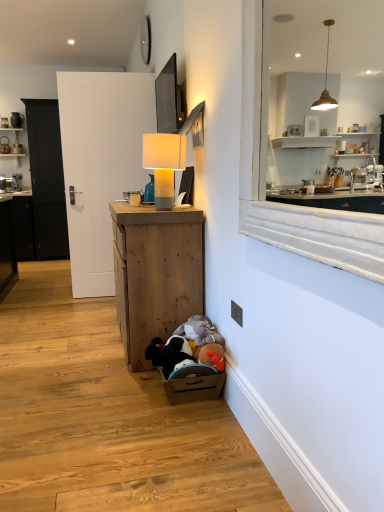
Question: From a real-world perspective, is wooden cabinet at lower center physically below matte gray table lamp at center?

Choices:
 (A) yes
 (B) no

Answer: (A)

Question: Is wooden cabinet at lower center further to camera compared to matte gray table lamp at center?

Choices:
 (A) yes
 (B) no

Answer: (A)

Question: From a real-world perspective, is wooden cabinet at lower center on top of matte gray table lamp at center?

Choices:
 (A) yes
 (B) no

Answer: (B)

Question: Considering the relative positions of wooden cabinet at lower center and matte gray table lamp at center in the image provided, is wooden cabinet at lower center to the left of matte gray table lamp at center from the viewer's perspective?

Choices:
 (A) no
 (B) yes

Answer: (B)

Question: Is wooden cabinet at lower center far away from matte gray table lamp at center?

Choices:
 (A) no
 (B) yes

Answer: (A)

Question: From their relative heights in the image, would you say matte gray table lamp at center is taller or shorter than white wooden door at center?

Choices:
 (A) tall
 (B) short

Answer: (B)

Question: From the image's perspective, is matte gray table lamp at center located above or below white wooden door at center?

Choices:
 (A) above
 (B) below

Answer: (B)

Question: From a real-world perspective, is matte gray table lamp at center positioned above or below white wooden door at center?

Choices:
 (A) below
 (B) above

Answer: (B)

Question: Considering the positions of matte gray table lamp at center and white wooden door at center in the image, is matte gray table lamp at center bigger or smaller than white wooden door at center?

Choices:
 (A) big
 (B) small

Answer: (B)

Question: From the image's perspective, is white wooden door at center above or below wooden cabinet at lower center?

Choices:
 (A) below
 (B) above

Answer: (B)

Question: Considering the positions of white wooden door at center and wooden cabinet at lower center in the image, is white wooden door at center wider or thinner than wooden cabinet at lower center?

Choices:
 (A) thin
 (B) wide

Answer: (A)

Question: Do you think white wooden door at center is within wooden cabinet at lower center, or outside of it?

Choices:
 (A) inside
 (B) outside

Answer: (B)

Question: Does point (120, 133) appear closer or farther from the camera than point (114, 252)?

Choices:
 (A) closer
 (B) farther

Answer: (B)

Question: Visually, is black plastic electric outlet at lower right positioned to the left or to the right of matte gray table lamp at center?

Choices:
 (A) right
 (B) left

Answer: (A)

Question: Relative to matte gray table lamp at center, is black plastic electric outlet at lower right in front or behind?

Choices:
 (A) behind
 (B) front

Answer: (B)